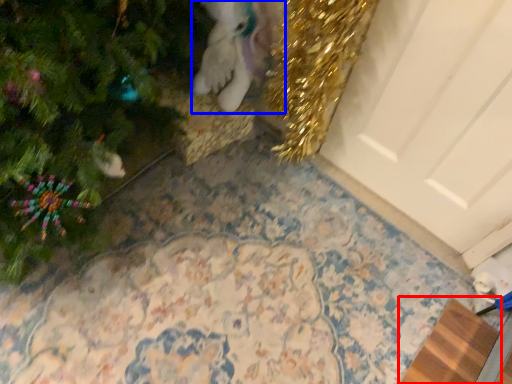
Question: Among these objects, which one is farthest to the camera, doormat (highlighted by a red box) or animal (highlighted by a blue box)?

Choices:
 (A) doormat
 (B) animal

Answer: (A)